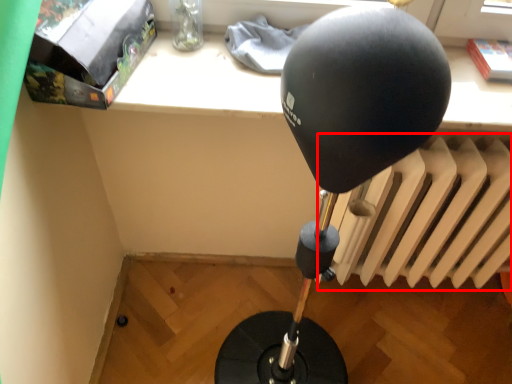
Question: Where is radiator (annotated by the red box) located in relation to package in the image?

Choices:
 (A) right
 (B) left

Answer: (A)